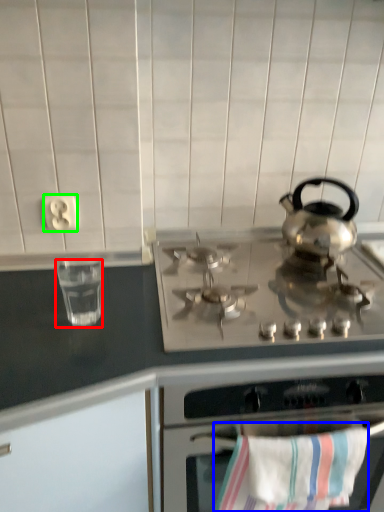
Question: Which object is positioned closest to appliance (highlighted by a red box)? Select from beach towel (highlighted by a blue box) and electric outlet (highlighted by a green box).

Choices:
 (A) beach towel
 (B) electric outlet

Answer: (B)